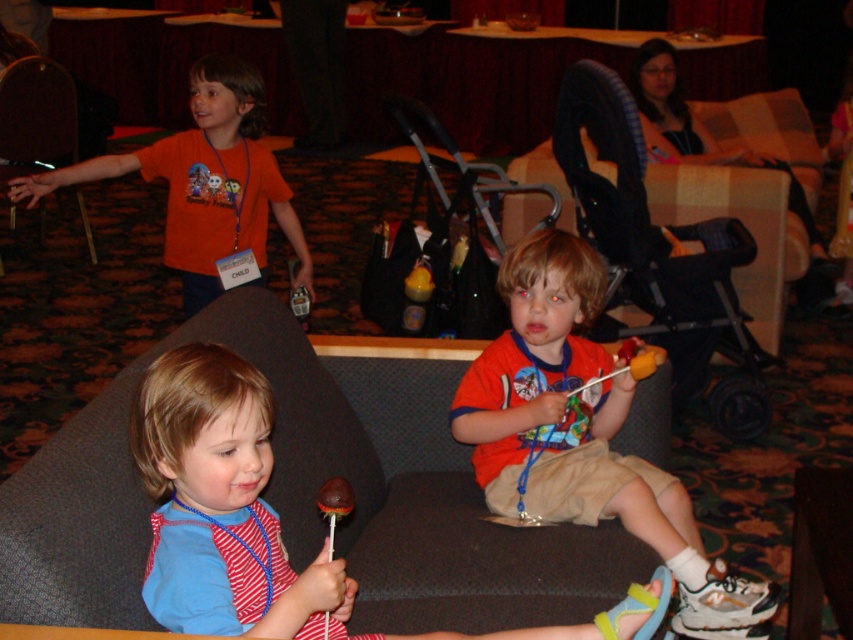
From the picture: You are a photographer setting up for a group photo. You need to ensure that the matte red shirt at center and the black plastic stroller at center are both visible in the frame. Given their sizes, which object should you prioritize positioning closer to the camera to maintain clarity?

The matte red shirt at center is thinner than the black plastic stroller at center, so you should prioritize positioning the matte red shirt at center closer to the camera to ensure it remains visible and clear in the photo.

You are a photographer at the event and need to capture a photo of both the striped cotton shirt at lower left and the black plastic stroller at center. Considering their heights, which object should you focus on first to ensure both are in frame?

The striped cotton shirt at lower left has a lesser height compared to the black plastic stroller at center. To ensure both are in frame, focus on the black plastic stroller at center first as it is taller, then adjust the camera angle to include the shorter striped cotton shirt at lower left.

You are standing in the room and see the point marked at coordinates (x=583, y=433). What object is located at that point?

The point at coordinates (x=583, y=433) marks the location of the matte red shirt at center.